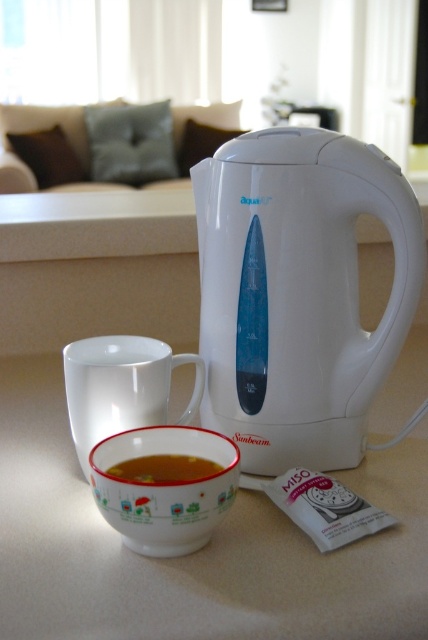
You are standing in the kitchen and want to grab the porcelain mug with green and red design at lower center. Can you reach it without moving the white glossy electric kettle at center?

The white glossy electric kettle at center is in front of the porcelain mug with green and red design at lower center, so you would need to move the kettle to access the mug.

You are preparing to place a spoon into the translucent glass bowl at lower center. The porcelain mug with green and red design at lower center is in the way. Can you move the mug to the right to make space?

Yes, you can move the porcelain mug with green and red design at lower center to the right since it is currently to the left of the translucent glass bowl at lower center, allowing space for the spoon.

You are a barista preparing a cup of coffee. You have a white electric kettle labeled Sunbeam on the countertop and a white glossy mug at lower center. How far apart are the kettle and the mug?

The white electric kettle labeled Sunbeam and the white glossy mug at lower center are 15.47 inches apart.